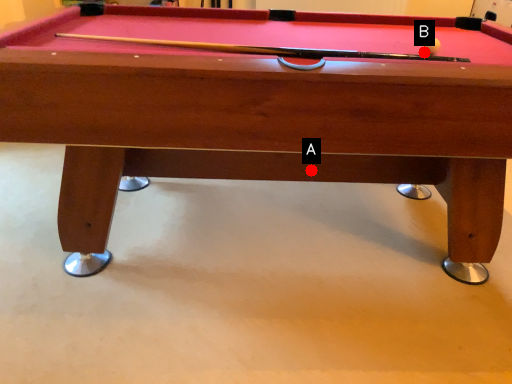
Question: Two points are circled on the image, labeled by A and B beside each circle. Which point appears closest to the camera in this image?

Choices:
 (A) A is closer
 (B) B is closer

Answer: (B)